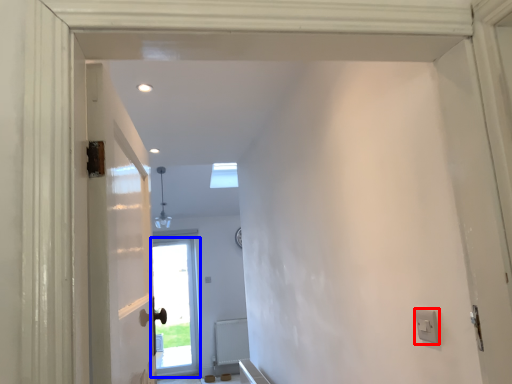
Question: Which of the following is the closest to the observer, electric outlet (highlighted by a red box) or door (highlighted by a blue box)?

Choices:
 (A) electric outlet
 (B) door

Answer: (A)